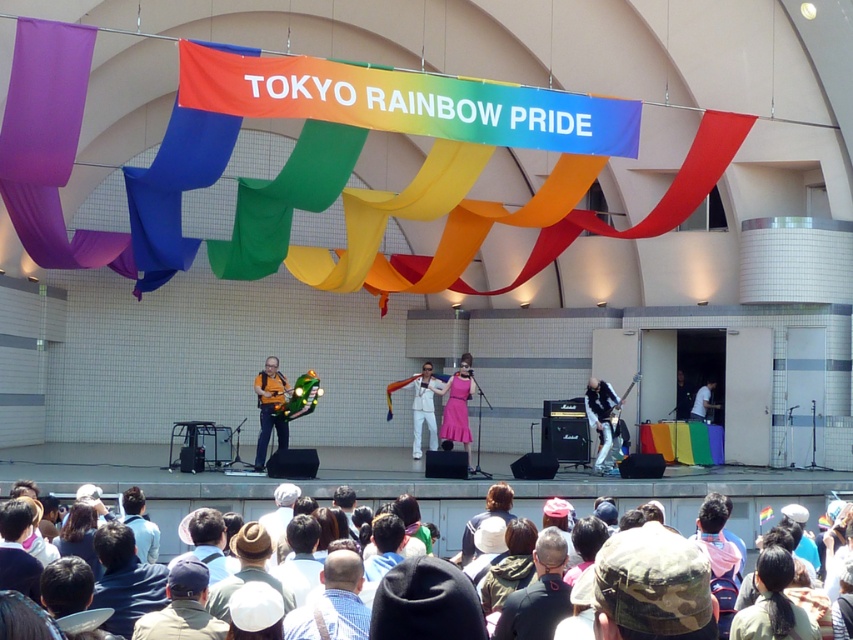
Who is more distant from viewer, (811, 500) or (271, 355)?

Positioned behind is point (271, 355).

Is multicolored fabric at lower center bigger than orange fabric at center?

Indeed, multicolored fabric at lower center has a larger size compared to orange fabric at center.

Identify the location of multicolored fabric at lower center. (691, 496).

The image size is (853, 640). Find the location of `multicolored fabric at lower center`. multicolored fabric at lower center is located at coordinates (691, 496).

From the picture: Can you confirm if camouflage hat at lower center is positioned above glossy black guitar at center?

Incorrect, camouflage hat at lower center is not positioned above glossy black guitar at center.

In the scene shown: Is camouflage hat at lower center taller than glossy black guitar at center?

Yes, camouflage hat at lower center is taller than glossy black guitar at center.

Identify the location of camouflage hat at lower center. (183, 608).

Describe the element at coordinates (604, 417) in the screenshot. I see `metallic silver guitar at center` at that location.

Is point (605, 404) positioned before point (610, 417)?

No, it is behind (610, 417).

What are the coordinates of `metallic silver guitar at center` in the screenshot? It's located at (604, 417).